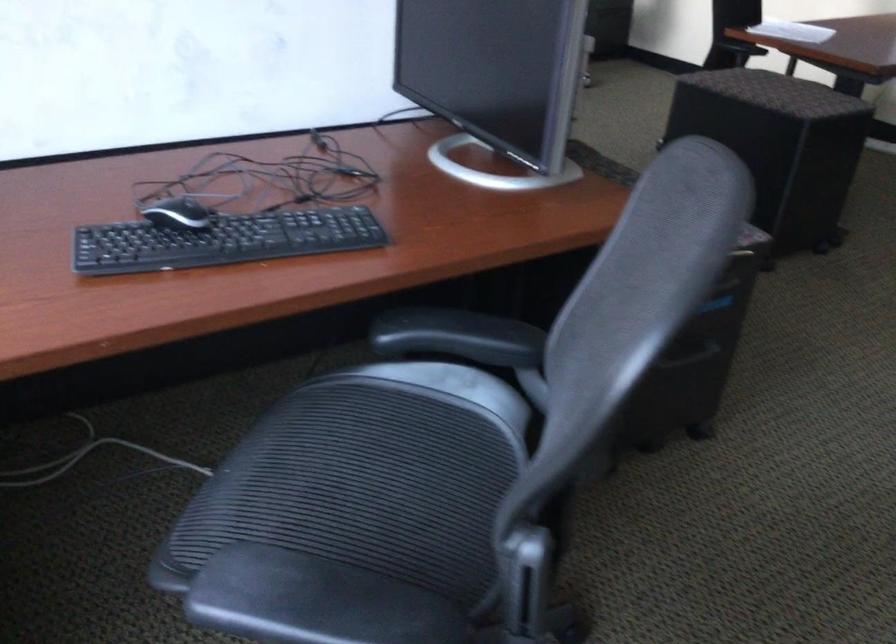
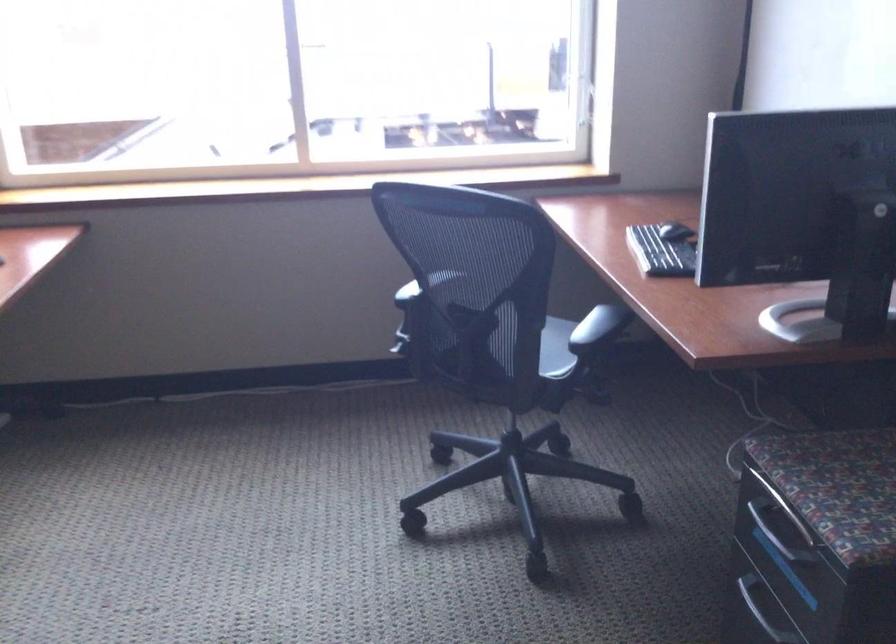
Where in the second image is the point corresponding to [702,355] from the first image?

(755, 614)